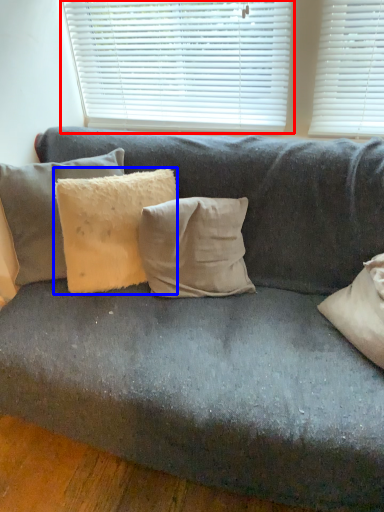
Question: Which of the following is the farthest to the observer, window blind (highlighted by a red box) or pillow (highlighted by a blue box)?

Choices:
 (A) window blind
 (B) pillow

Answer: (A)